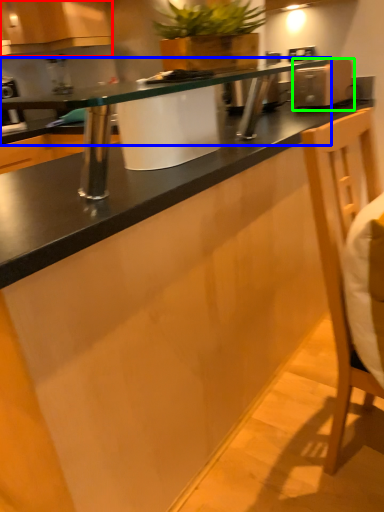
Question: Based on their relative distances, which object is farther from cabinetry (highlighted by a red box)? Choose from countertop (highlighted by a blue box) and appliance (highlighted by a green box).

Choices:
 (A) countertop
 (B) appliance

Answer: (B)